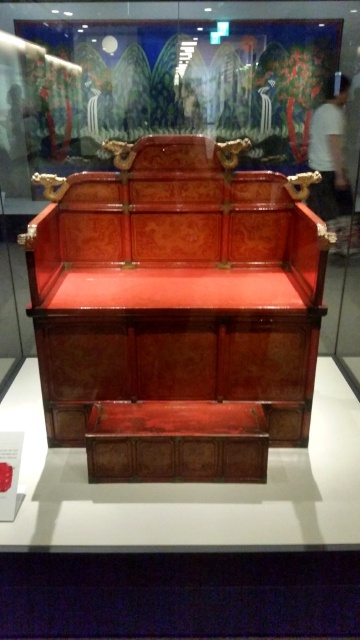
You are a visitor at the museum and want to take a photo of the wooden carved bench at center. The museum requires you to stand exactly at the point with coordinates point (x=176, y=285) to take the photo. Is this point located on the wooden carved bench at center?

The point (x=176, y=285) corresponds to the wooden carved bench at center, so yes, the point is located on the wooden carved bench at center.

You are a visitor at the museum and want to take a photo of both the wooden carved bench at center and the shiny brown wooden chest at center. Which object should you focus on first to ensure both are in clear view?

You should focus on the wooden carved bench at center first since it is closer to the viewer, ensuring both objects will be in clear view when properly focused.

You are a museum curator planning to move the wooden carved bench at center and the shiny brown wooden chest at center to a new exhibition space. The new space has a narrow doorway that is 1.2 meters wide. Can both items pass through the doorway side by side without rotating them?

The wooden carved bench at center is bigger than the shiny brown wooden chest at center. Since the bench is larger, its width might exceed the 1.2 meters doorway. However, without specific width measurements, it is uncertain if they can pass side by side. Additional measurements are needed to confirm.